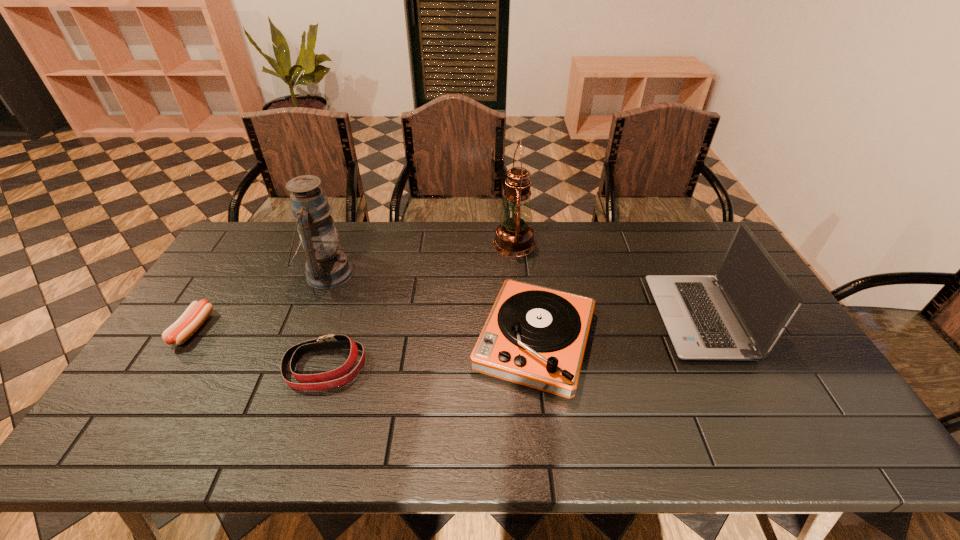
Identify which object is the fifth nearest to the shortest object. Please provide its 2D coordinates. Your answer should be formatted as a tuple, i.e. [(x, y)], where the tuple contains the x and y coordinates of a point satisfying the conditions above.

[(740, 313)]

The width and height of the screenshot is (960, 540). Find the location of `object that can be found as the fifth closest to the right oil lamp`. object that can be found as the fifth closest to the right oil lamp is located at coordinates [x=195, y=315].

Locate an element on the screen. free space in the image that satisfies the following two spatial constraints: 1. on the screen of the rightmost object; 2. on the front side of the dog collar is located at coordinates (723, 368).

Where is `vacant position in the image that satisfies the following two spatial constraints: 1. on the front side of the record player; 2. on the right side of the right oil lamp`? vacant position in the image that satisfies the following two spatial constraints: 1. on the front side of the record player; 2. on the right side of the right oil lamp is located at coordinates (523, 340).

I want to click on vacant space that satisfies the following two spatial constraints: 1. on the back side of the left oil lamp; 2. on the right side of the sausage, so [x=228, y=274].